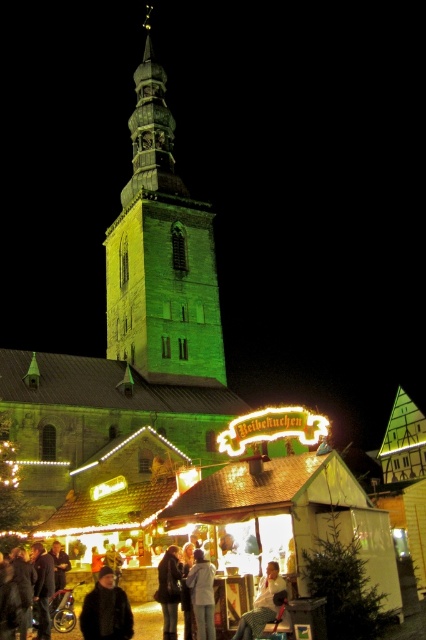
Who is lower down, dark brown leather coat at lower left or light gray fabric jacket at lower center?

Positioned lower is light gray fabric jacket at lower center.

In the scene shown: Who is shorter, dark brown leather coat at lower left or light gray fabric jacket at lower center?

With less height is dark brown leather coat at lower left.

This screenshot has height=640, width=426. Identify the location of dark brown leather coat at lower left. (106, 611).

Based on the photo, is light brown leather jacket at lower center further to camera compared to dark gray jacket at center?

No, light brown leather jacket at lower center is closer to the viewer.

Is point (247, 634) closer to viewer compared to point (176, 570)?

Yes, point (247, 634) is closer to viewer.

Where is `light brown leather jacket at lower center`? Image resolution: width=426 pixels, height=640 pixels. light brown leather jacket at lower center is located at coordinates (262, 604).

Is dark brown leather coat at lower left in front of dark gray jacket at center?

Yes.

Can you confirm if dark brown leather coat at lower left is positioned above dark gray jacket at center?

Indeed, dark brown leather coat at lower left is positioned over dark gray jacket at center.

Which is in front, point (97, 620) or point (161, 568)?

Point (97, 620)

Where is `dark brown leather coat at lower left`? dark brown leather coat at lower left is located at coordinates (106, 611).